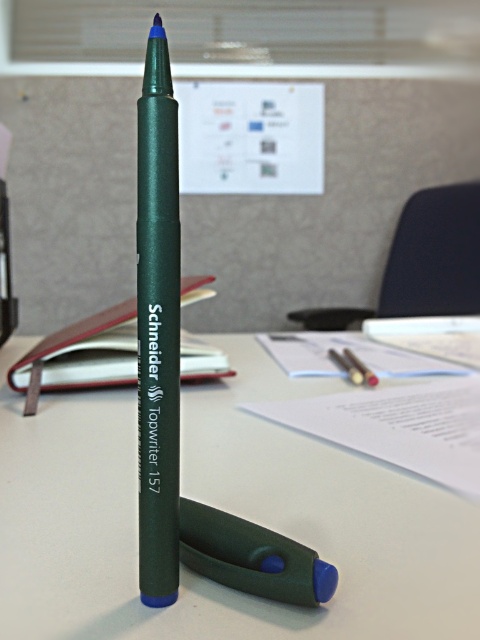
Measure the distance from white matte table at center to green rubberized pen at center.

white matte table at center is 9.22 inches away from green rubberized pen at center.

Which of these two, white matte table at center or green rubberized pen at center, stands shorter?

green rubberized pen at center

Does point (323, 525) come in front of point (300, 568)?

No, it is not.

What are the coordinates of `white matte table at center` in the screenshot? It's located at (223, 509).

Can you confirm if white matte table at center is smaller than green matte marker at center?

Actually, white matte table at center might be larger than green matte marker at center.

Is white matte table at center to the left of green matte marker at center from the viewer's perspective?

Yes, white matte table at center is to the left of green matte marker at center.

Where is `white matte table at center`? white matte table at center is located at coordinates (223, 509).

At what (x,y) coordinates should I click in order to perform the action: click on white matte table at center. Please return your answer as a coordinate pair (x, y). This screenshot has height=640, width=480. Looking at the image, I should click on (223, 509).

In the scene shown: Is green matte marker at center to the left of green rubberized pen at center from the viewer's perspective?

Correct, you'll find green matte marker at center to the left of green rubberized pen at center.

Is green matte marker at center smaller than green rubberized pen at center?

No.

This screenshot has width=480, height=640. Describe the element at coordinates (157, 326) in the screenshot. I see `green matte marker at center` at that location.

You are a GUI agent. You are given a task and a screenshot of the screen. Output one action in this format:
    pyautogui.click(x=<x>, y=<y>)
    Task: Click on the green matte marker at center
    
    Given the screenshot: What is the action you would take?
    pyautogui.click(x=157, y=326)